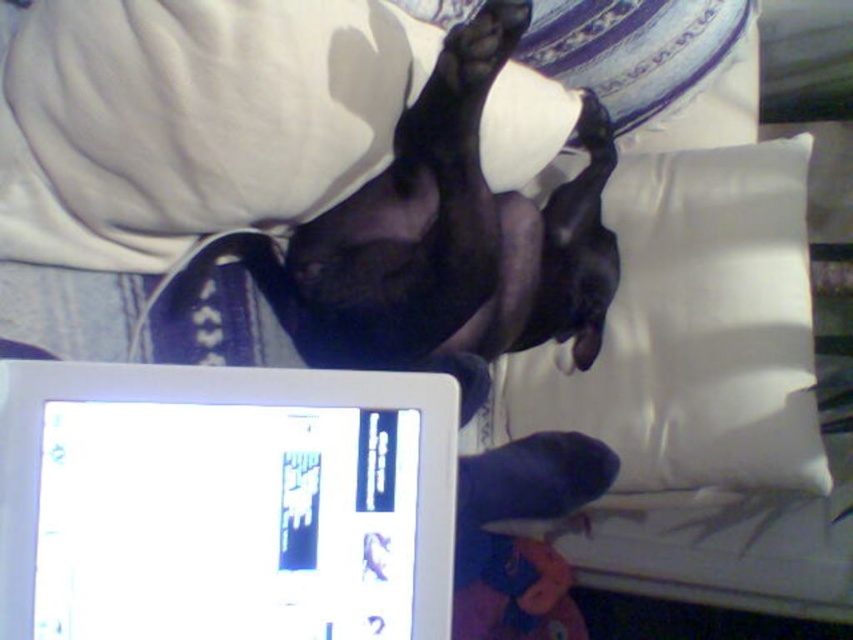
Question: Is white glossy tablet at lower left to the left of black matte paw at upper center from the viewer's perspective?

Choices:
 (A) no
 (B) yes

Answer: (B)

Question: Is white glossy tablet at lower left to the left of black matte paw at upper center from the viewer's perspective?

Choices:
 (A) no
 (B) yes

Answer: (B)

Question: Based on their relative distances, which object is nearer to the satin white pillow at upper right?

Choices:
 (A) white glossy tablet at lower left
 (B) black smooth dog at center
 (C) black matte paw at upper center

Answer: (B)

Question: Can you confirm if white glossy tablet at lower left is thinner than satin white pillow at upper right?

Choices:
 (A) no
 (B) yes

Answer: (B)

Question: Which object appears farthest from the camera in this image?

Choices:
 (A) white glossy tablet at lower left
 (B) black smooth dog at center
 (C) satin white pillow at upper right
 (D) black matte paw at upper center

Answer: (C)

Question: Which point is farther from the camera taking this photo?

Choices:
 (A) (3, 397)
 (B) (674, 323)
 (C) (390, 172)

Answer: (B)